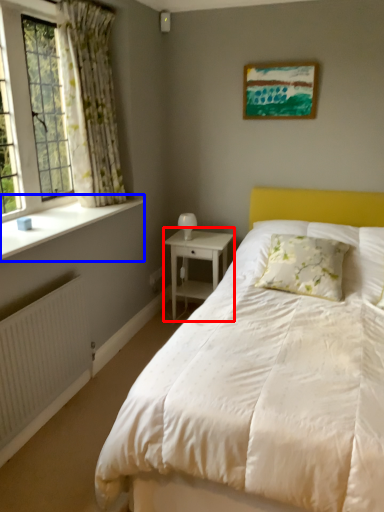
Question: Which object is further to the camera taking this photo, nightstand (highlighted by a red box) or window sill (highlighted by a blue box)?

Choices:
 (A) nightstand
 (B) window sill

Answer: (A)